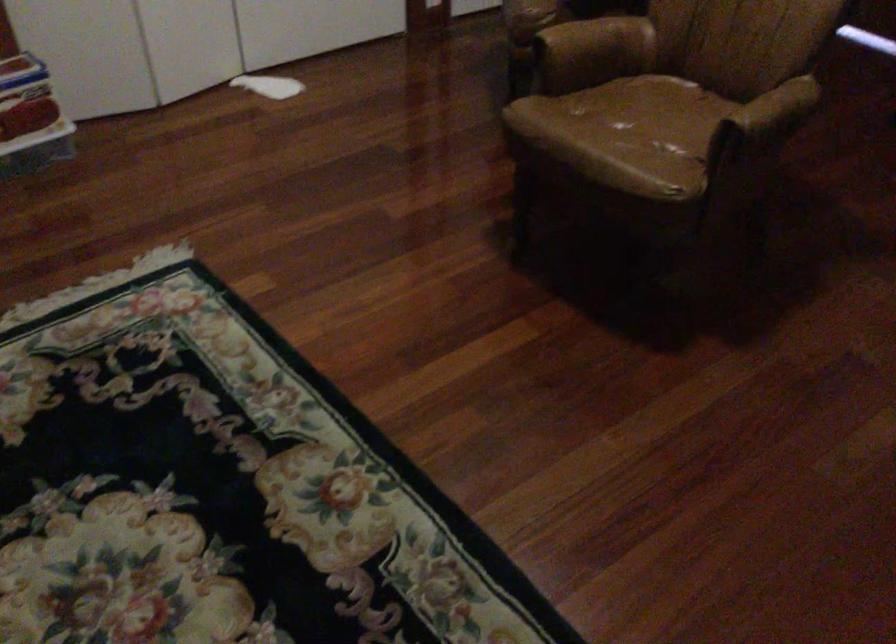
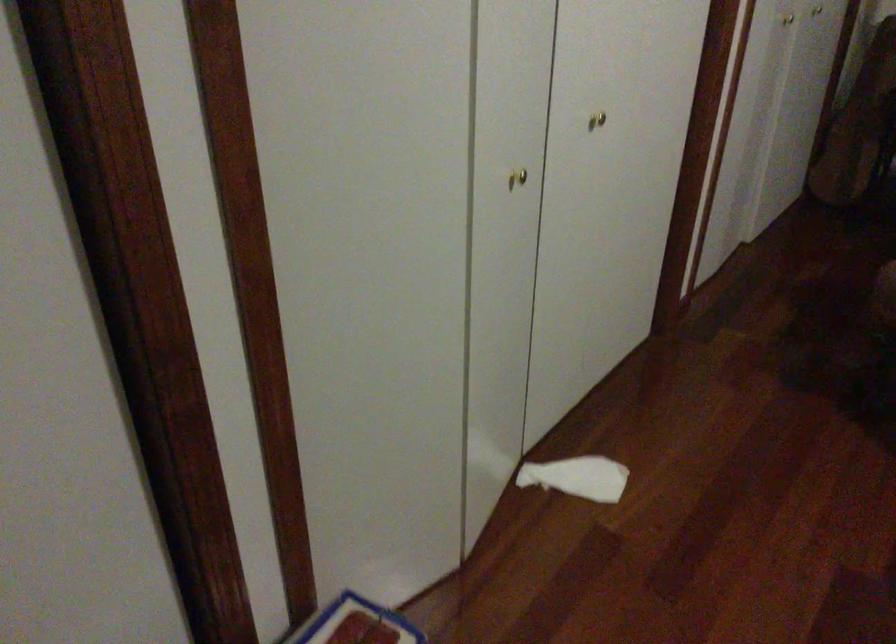
In the second image, find the point that corresponds to point 280,82 in the first image.

(578, 477)